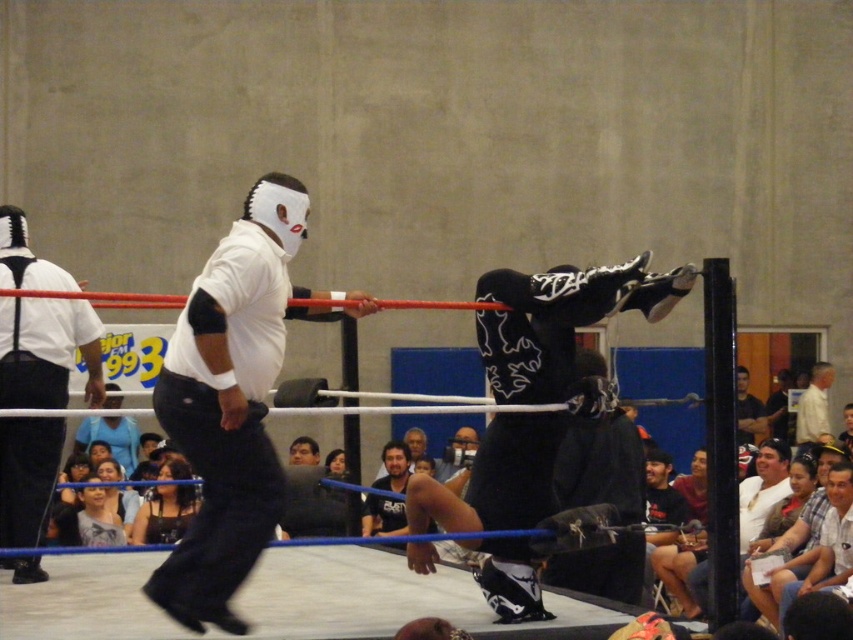
Question: Is light blue fabric at lower left wider than dark blue jeans at center?

Choices:
 (A) no
 (B) yes

Answer: (A)

Question: Which object appears closest to the camera in this image?

Choices:
 (A) black fabric dress at lower left
 (B) light blue fabric at lower left

Answer: (B)

Question: Can you confirm if black matte mask at center is positioned to the right of black fabric dress at lower left?

Choices:
 (A) no
 (B) yes

Answer: (B)

Question: Does dark blue shirt at center appear on the left side of white shirt at upper center?

Choices:
 (A) yes
 (B) no

Answer: (A)

Question: Estimate the real-world distances between objects in this image. Which object is closer to the black matte mask at center?

Choices:
 (A) white matte mask at upper center
 (B) light blue fabric at lower left

Answer: (A)

Question: Estimate the real-world distances between objects in this image. Which object is farther from the black fabric dress at lower left?

Choices:
 (A) dark blue shirt at center
 (B) dark blue jeans at center
 (C) light blue fabric at lower left

Answer: (B)